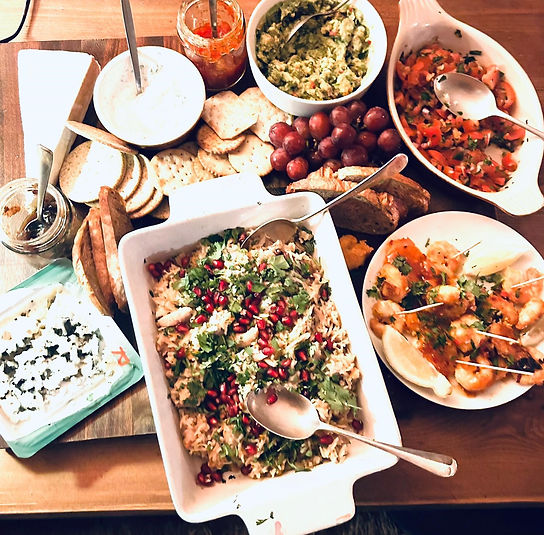
This screenshot has height=535, width=544. I want to click on cutting board, so click(x=109, y=57), click(x=123, y=421).